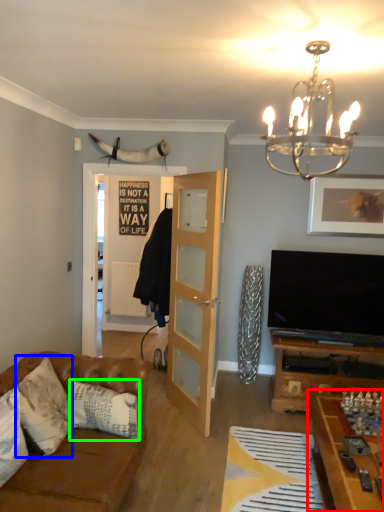
Question: Which is nearer to the table (highlighted by a red box)? pillow (highlighted by a blue box) or pillow (highlighted by a green box).

Choices:
 (A) pillow
 (B) pillow

Answer: (B)